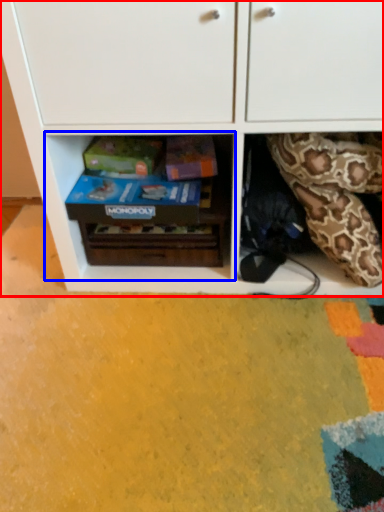
Question: Which object is closer to the camera taking this photo, cabinetry (highlighted by a red box) or shelf (highlighted by a blue box)?

Choices:
 (A) cabinetry
 (B) shelf

Answer: (A)